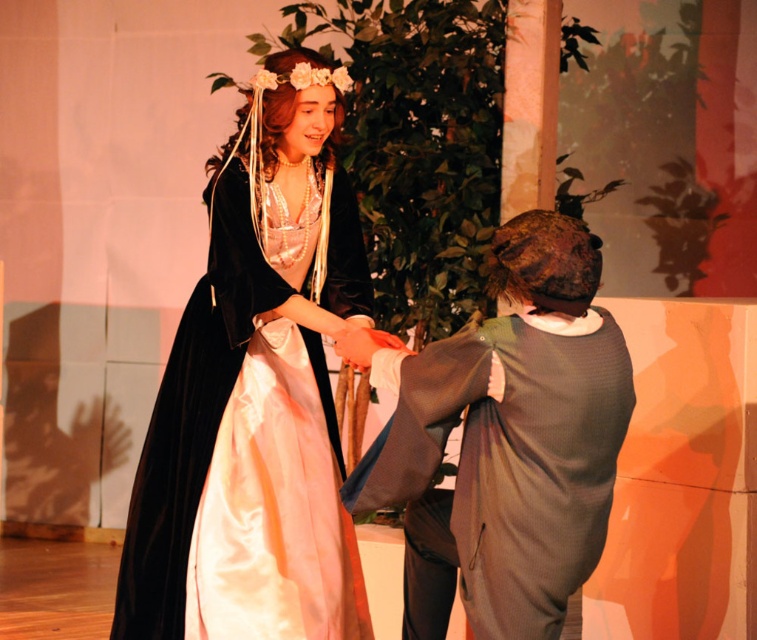
Question: Is velvet black dress at center to the right of dark gray wool coat at center from the viewer's perspective?

Choices:
 (A) no
 (B) yes

Answer: (A)

Question: Does velvet black dress at center appear on the right side of dark gray wool coat at center?

Choices:
 (A) no
 (B) yes

Answer: (A)

Question: Does velvet black dress at center have a greater width compared to dark gray wool coat at center?

Choices:
 (A) yes
 (B) no

Answer: (A)

Question: Which point is closer to the camera?

Choices:
 (A) (307, 401)
 (B) (540, 529)

Answer: (B)

Question: Which point is closer to the camera taking this photo?

Choices:
 (A) (245, 108)
 (B) (528, 392)

Answer: (B)